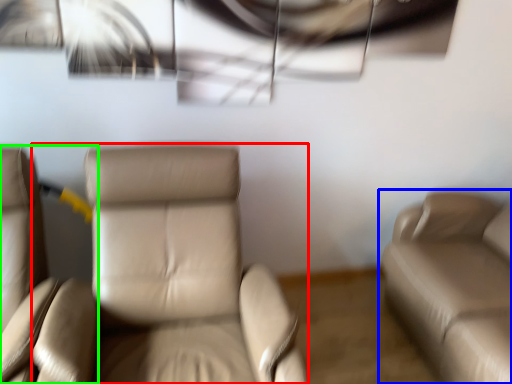
Question: Which is nearer to the chair (highlighted by a red box)? studio couch (highlighted by a blue box) or chair (highlighted by a green box).

Choices:
 (A) studio couch
 (B) chair

Answer: (B)